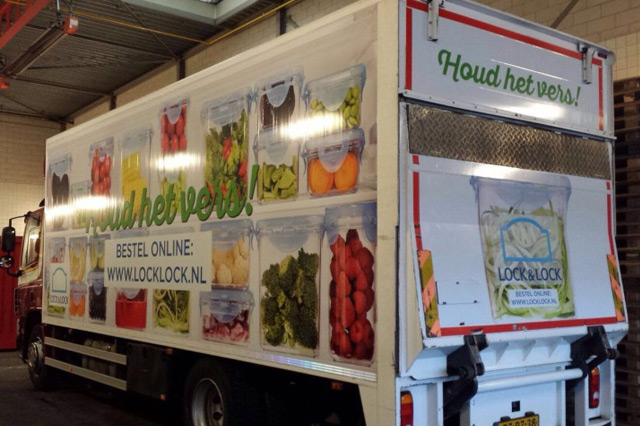
At what (x,y) coordinates should I click in order to perform the action: click on window. Please return your answer as a coordinate pair (x, y). The width and height of the screenshot is (640, 426). Looking at the image, I should click on (29, 242).